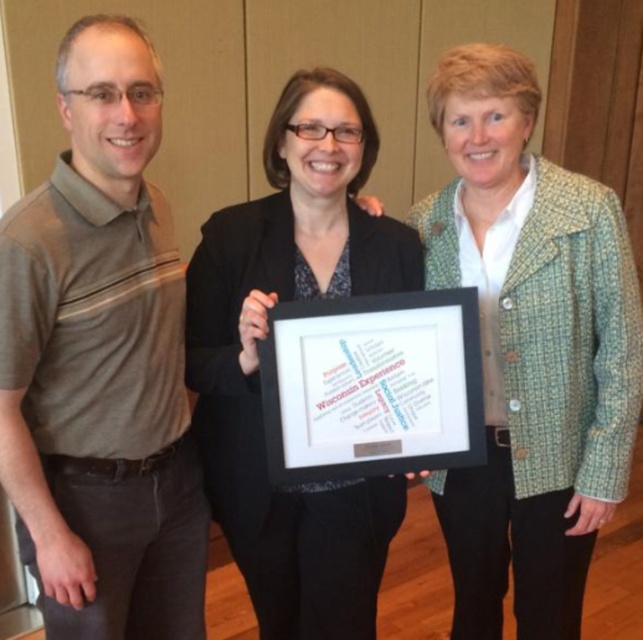
Question: Which of these objects is positioned closest to the green tweed blazer at center?

Choices:
 (A) black fabric at center
 (B) gray striped polo shirt at left

Answer: (A)

Question: Does green tweed blazer at center lie behind black fabric at center?

Choices:
 (A) yes
 (B) no

Answer: (A)

Question: Estimate the real-world distances between objects in this image. Which object is farther from the black fabric at center?

Choices:
 (A) green tweed blazer at center
 (B) gray striped polo shirt at left

Answer: (A)

Question: Can you confirm if gray striped polo shirt at left is wider than green tweed blazer at center?

Choices:
 (A) no
 (B) yes

Answer: (A)

Question: Where is gray striped polo shirt at left located in relation to green tweed blazer at center in the image?

Choices:
 (A) above
 (B) below

Answer: (A)

Question: Which object appears closest to the camera in this image?

Choices:
 (A) gray striped polo shirt at left
 (B) green tweed blazer at center

Answer: (A)